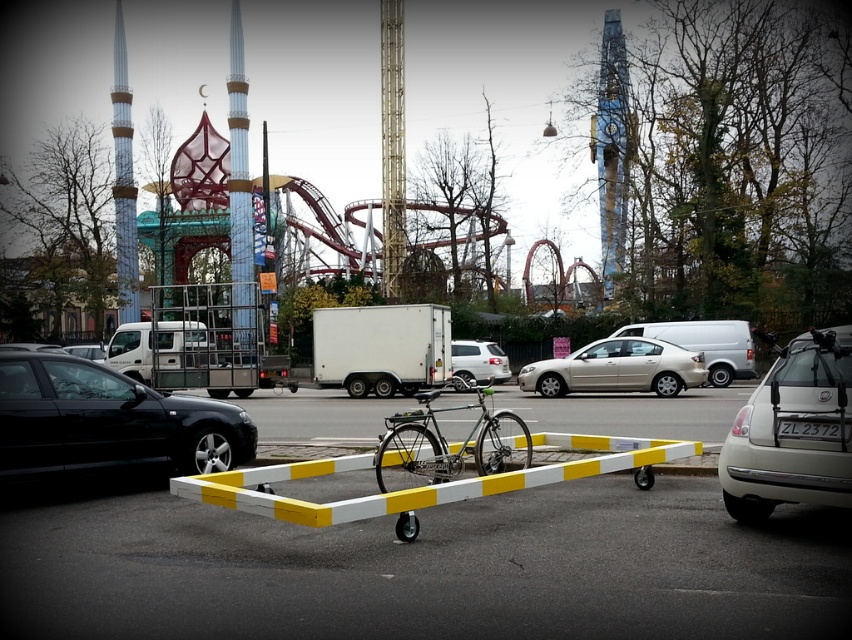
You are standing at the center of the parking lot and want to find the shiny black sedan at left. According to the coordinates provided, in which direction should you look to locate it?

The shiny black sedan at left is located at coordinates point (107, 422), so you should look to the left side of the parking lot to locate it.

You are standing in the amusement park parking lot and want to locate two specific points marked on the ground. The first point is at coordinates point (x=490, y=499) and the second is at point (x=400, y=488). Which of these two points is closer to you?

Point (x=490, y=499) is closer to the viewer than point (x=400, y=488).